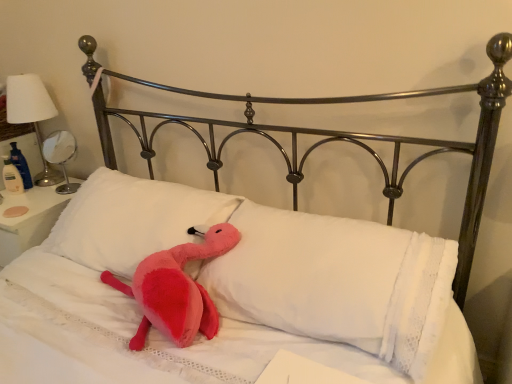
Image resolution: width=512 pixels, height=384 pixels. I want to click on white glossy table lamp at left, the second table lamp when ordered from left to right, so [61, 156].

Measure the distance between point (355, 265) and camera.

Point (355, 265) is 3.69 feet from camera.

Where is `white soft pillow at center, which is the 2th pillow in right-to-left order`? The image size is (512, 384). white soft pillow at center, which is the 2th pillow in right-to-left order is located at coordinates (132, 220).

Is white soft pillow at center, which is the second pillow in left-to-right order, facing away from white glossy table lamp at left, the second table lamp when ordered from left to right?

No, white soft pillow at center, which is the second pillow in left-to-right order, is not facing away from white glossy table lamp at left, the second table lamp when ordered from left to right.

From the image's perspective, which one is positioned higher, white soft pillow at center, which ranks as the first pillow in right-to-left order, or white glossy table lamp at left, the first table lamp positioned from the right?

From the image's view, white glossy table lamp at left, the first table lamp positioned from the right, is above.

Considering the relative sizes of white soft pillow at center, which is the second pillow in left-to-right order, and white glossy table lamp at left, the second table lamp when ordered from left to right, in the image provided, is white soft pillow at center, which is the second pillow in left-to-right order, bigger than white glossy table lamp at left, the second table lamp when ordered from left to right,?

Correct, white soft pillow at center, which is the second pillow in left-to-right order, is larger in size than white glossy table lamp at left, the second table lamp when ordered from left to right.

Is white soft pillow at center, which ranks as the first pillow in right-to-left order, beside white glossy table lamp at left, the first table lamp positioned from the right?

white soft pillow at center, which ranks as the first pillow in right-to-left order, and white glossy table lamp at left, the first table lamp positioned from the right, are not in contact.

Is metallic silver table lamp at left, which is the first table lamp from left to right, not near white glossy table lamp at left, the second table lamp when ordered from left to right?

No, there isn't a large distance between metallic silver table lamp at left, which is the first table lamp from left to right, and white glossy table lamp at left, the second table lamp when ordered from left to right.

Which object is wider, metallic silver table lamp at left, which is the first table lamp from left to right, or white glossy table lamp at left, the second table lamp when ordered from left to right?

Wider between the two is metallic silver table lamp at left, which is the first table lamp from left to right.

Considering the positions of point (15, 76) and point (56, 138), is point (15, 76) closer or farther from the camera than point (56, 138)?

Point (15, 76) is closer to the camera than point (56, 138).

Is metallic silver table lamp at left, which is the first table lamp from left to right, to the right of white glossy table lamp at left, the first table lamp positioned from the right, from the viewer's perspective?

No, metallic silver table lamp at left, which is the first table lamp from left to right, is not to the right of white glossy table lamp at left, the first table lamp positioned from the right.

Looking at this image, is white soft pillow at center, which is the second pillow in left-to-right order, not close to white soft pillow at center, the first pillow viewed from the left?

No, white soft pillow at center, which is the second pillow in left-to-right order, is not far from white soft pillow at center, the first pillow viewed from the left.

Would you say white soft pillow at center, which ranks as the first pillow in right-to-left order, contains white soft pillow at center, the first pillow viewed from the left?

No, white soft pillow at center, which ranks as the first pillow in right-to-left order, does not contain white soft pillow at center, the first pillow viewed from the left.

Is white soft pillow at center, which ranks as the first pillow in right-to-left order, at the right side of white soft pillow at center, the first pillow viewed from the left?

Correct, you'll find white soft pillow at center, which ranks as the first pillow in right-to-left order, to the right of white soft pillow at center, the first pillow viewed from the left.

How different are the orientations of metallic silver table lamp at left, which is the first table lamp from left to right, and white soft pillow at center, which is the 2th pillow in right-to-left order, in degrees?

They differ by 3.68 degrees in their facing directions.

At what (x,y) coordinates should I click in order to perform the action: click on the 2nd table lamp positioned above the white soft pillow at center, the first pillow viewed from the left (from a real-world perspective). Please return your answer as a coordinate pair (x, y). Looking at the image, I should click on (32, 115).

Is metallic silver table lamp at left, the 2th table lamp in the right-to-left sequence, in front of or behind white soft pillow at center, the first pillow viewed from the left, in the image?

metallic silver table lamp at left, the 2th table lamp in the right-to-left sequence, is behind white soft pillow at center, the first pillow viewed from the left.

Is white glossy table lamp at left, the first table lamp positioned from the right, behind metallic silver table lamp at left, the 2th table lamp in the right-to-left sequence?

Yes, white glossy table lamp at left, the first table lamp positioned from the right, is further from the camera.

Is white glossy table lamp at left, the second table lamp when ordered from left to right, wider than metallic silver table lamp at left, the 2th table lamp in the right-to-left sequence?

No.

Where is `table lamp that appears above the white glossy table lamp at left, the second table lamp when ordered from left to right (from a real-world perspective)`? table lamp that appears above the white glossy table lamp at left, the second table lamp when ordered from left to right (from a real-world perspective) is located at coordinates (32, 115).

How much distance is there between white glossy table lamp at left, the second table lamp when ordered from left to right, and metallic silver table lamp at left, which is the first table lamp from left to right?

A distance of 5.84 inches exists between white glossy table lamp at left, the second table lamp when ordered from left to right, and metallic silver table lamp at left, which is the first table lamp from left to right.

Looking at this image, what's the angular difference between white soft pillow at center, the first pillow viewed from the left, and metallic silver table lamp at left, which is the first table lamp from left to right,'s facing directions?

The angular difference between white soft pillow at center, the first pillow viewed from the left, and metallic silver table lamp at left, which is the first table lamp from left to right, is 3.68 degrees.

Could you tell me if white soft pillow at center, which is the 2th pillow in right-to-left order, is facing metallic silver table lamp at left, which is the first table lamp from left to right?

No, white soft pillow at center, which is the 2th pillow in right-to-left order, is not aimed at metallic silver table lamp at left, which is the first table lamp from left to right.

Which is closer to the camera, (90, 251) or (7, 111)?

Point (90, 251) is positioned closer to the camera compared to point (7, 111).

Between white soft pillow at center, the first pillow viewed from the left, and metallic silver table lamp at left, the 2th table lamp in the right-to-left sequence, which one has larger size?

A: With larger size is white soft pillow at center, the first pillow viewed from the left.

Identify the location of the 2nd pillow counting from the right of the metallic silver table lamp at left, the 2th table lamp in the right-to-left sequence. (337, 281).

Is metallic silver table lamp at left, the 2th table lamp in the right-to-left sequence, facing towards white soft pillow at center, which is the second pillow in left-to-right order?

No, metallic silver table lamp at left, the 2th table lamp in the right-to-left sequence, is not aimed at white soft pillow at center, which is the second pillow in left-to-right order.

Is metallic silver table lamp at left, which is the first table lamp from left to right, at the left side of white soft pillow at center, which is the second pillow in left-to-right order?

Yes, metallic silver table lamp at left, which is the first table lamp from left to right, is to the left of white soft pillow at center, which is the second pillow in left-to-right order.

Which object is further away from the camera, metallic silver table lamp at left, the 2th table lamp in the right-to-left sequence, or white soft pillow at center, which is the second pillow in left-to-right order?

metallic silver table lamp at left, the 2th table lamp in the right-to-left sequence, is further from the camera.

The image size is (512, 384). Identify the location of the 2nd pillow below the white glossy table lamp at left, the second table lamp when ordered from left to right (from the image's perspective). (337, 281).

Identify the location of table lamp to the left of white glossy table lamp at left, the second table lamp when ordered from left to right. Image resolution: width=512 pixels, height=384 pixels. (32, 115).

Based on their spatial positions, is white soft pillow at center, which is the second pillow in left-to-right order, or white soft pillow at center, which is the 2th pillow in right-to-left order, closer to metallic silver table lamp at left, the 2th table lamp in the right-to-left sequence?

Based on the image, white soft pillow at center, which is the 2th pillow in right-to-left order, appears to be nearer to metallic silver table lamp at left, the 2th table lamp in the right-to-left sequence.

Looking at the image, which one is located closer to white soft pillow at center, which ranks as the first pillow in right-to-left order, white glossy table lamp at left, the first table lamp positioned from the right, or metallic silver table lamp at left, which is the first table lamp from left to right?

white glossy table lamp at left, the first table lamp positioned from the right.

When comparing their distances from white glossy table lamp at left, the second table lamp when ordered from left to right, does white soft pillow at center, which is the second pillow in left-to-right order, or white soft pillow at center, the first pillow viewed from the left, seem closer?

The object closer to white glossy table lamp at left, the second table lamp when ordered from left to right, is white soft pillow at center, the first pillow viewed from the left.

Looking at this image, when comparing their distances from white soft pillow at center, which is the 2th pillow in right-to-left order, does white soft pillow at center, which ranks as the first pillow in right-to-left order, or metallic silver table lamp at left, which is the first table lamp from left to right, seem closer?

white soft pillow at center, which ranks as the first pillow in right-to-left order.

From the image, which object appears to be farther from metallic silver table lamp at left, the 2th table lamp in the right-to-left sequence, white glossy table lamp at left, the second table lamp when ordered from left to right, or white soft pillow at center, which is the second pillow in left-to-right order?

white soft pillow at center, which is the second pillow in left-to-right order, lies further to metallic silver table lamp at left, the 2th table lamp in the right-to-left sequence, than the other object.

Estimate the real-world distances between objects in this image. Which object is further from white soft pillow at center, the first pillow viewed from the left, white glossy table lamp at left, the second table lamp when ordered from left to right, or metallic silver table lamp at left, the 2th table lamp in the right-to-left sequence?

metallic silver table lamp at left, the 2th table lamp in the right-to-left sequence, is positioned further to the anchor white soft pillow at center, the first pillow viewed from the left.

Based on their spatial positions, is white soft pillow at center, which is the 2th pillow in right-to-left order, or white glossy table lamp at left, the second table lamp when ordered from left to right, closer to metallic silver table lamp at left, the 2th table lamp in the right-to-left sequence?

Among the two, white glossy table lamp at left, the second table lamp when ordered from left to right, is located nearer to metallic silver table lamp at left, the 2th table lamp in the right-to-left sequence.

Considering their positions, is metallic silver table lamp at left, which is the first table lamp from left to right, positioned further to white soft pillow at center, which ranks as the first pillow in right-to-left order, than white soft pillow at center, which is the 2th pillow in right-to-left order?

Among the two, metallic silver table lamp at left, which is the first table lamp from left to right, is located further to white soft pillow at center, which ranks as the first pillow in right-to-left order.

I want to click on pillow between metallic silver table lamp at left, which is the first table lamp from left to right, and white soft pillow at center, which ranks as the first pillow in right-to-left order, from left to right, so click(x=132, y=220).

Locate an element on the screen. This screenshot has width=512, height=384. table lamp between white soft pillow at center, which is the 2th pillow in right-to-left order, and white glossy table lamp at left, the second table lamp when ordered from left to right, along the z-axis is located at coordinates (32, 115).

Locate an element on the screen. The image size is (512, 384). table lamp between metallic silver table lamp at left, the 2th table lamp in the right-to-left sequence, and white soft pillow at center, which ranks as the first pillow in right-to-left order is located at coordinates (61, 156).

I want to click on pillow situated between white glossy table lamp at left, the second table lamp when ordered from left to right, and white soft pillow at center, which is the second pillow in left-to-right order, from left to right, so click(x=132, y=220).